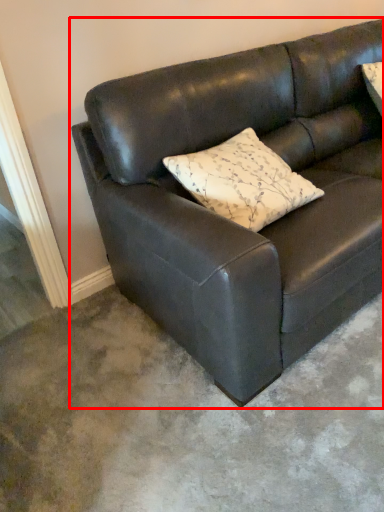
Question: From the image, what is the correct spatial relationship of studio couch (annotated by the red box) in relation to pillow?

Choices:
 (A) left
 (B) right

Answer: (B)